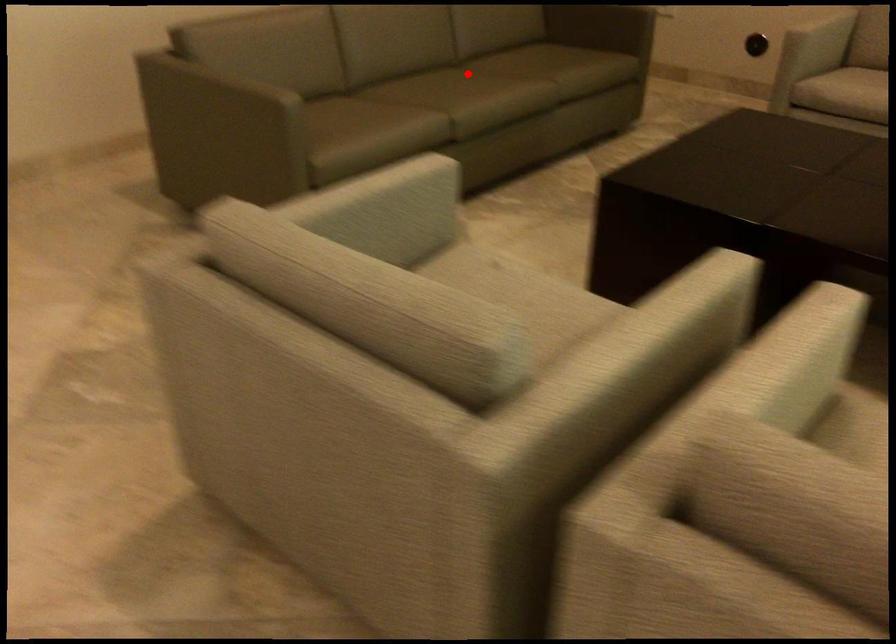
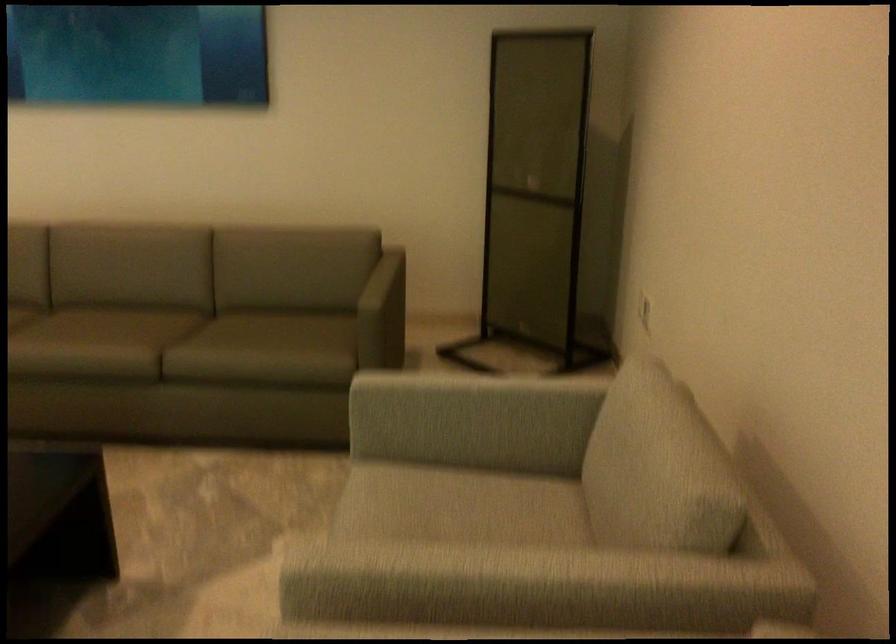
Question: I am providing you with two images of the same scene from different viewpoints. Image1 has a red point marked. In image2, the corresponding 3D location appears at what relative position? Reply with the corresponding letter.

Choices:
 (A) Closer
 (B) Farther

Answer: (A)